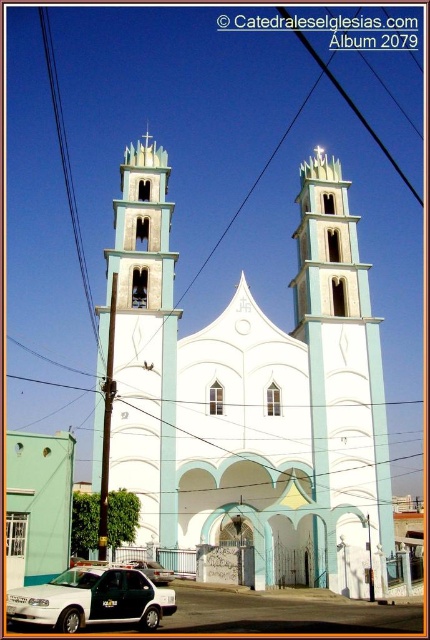
You are an urban planner assessing the space between the white stucco tower at center and the black wire at left. The city requires a minimum of 50 meters between such structures for safety. Does the current distance meet the requirement?

The white stucco tower at center and the black wire at left are 56.06 meters apart from each other, which exceeds the required 50 meters, so the safety requirement is met.

You are a city planner reviewing the layout of the church and its surroundings. Based on the image, which object is positioned lower in the scene, the white stucco tower at center or the black wire at left?

The white stucco tower at center is positioned lower in the scene than the black wire at left according to the description.

What are the coordinates of the white stucco tower at center?

The coordinates of the white stucco tower at center are point (340, 381).